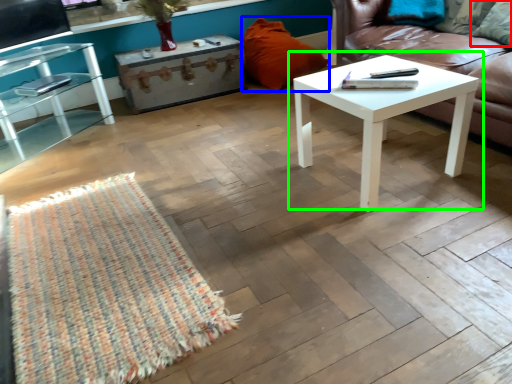
Question: Which object is positioned farthest from pillow (highlighted by a red box)? Select from pillow (highlighted by a blue box) and coffee table (highlighted by a green box).

Choices:
 (A) pillow
 (B) coffee table

Answer: (A)